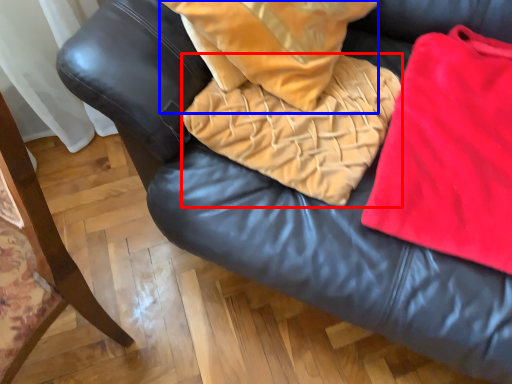
Question: Which object appears farthest to the camera in this image, blanket (highlighted by a red box) or throw pillow (highlighted by a blue box)?

Choices:
 (A) blanket
 (B) throw pillow

Answer: (A)